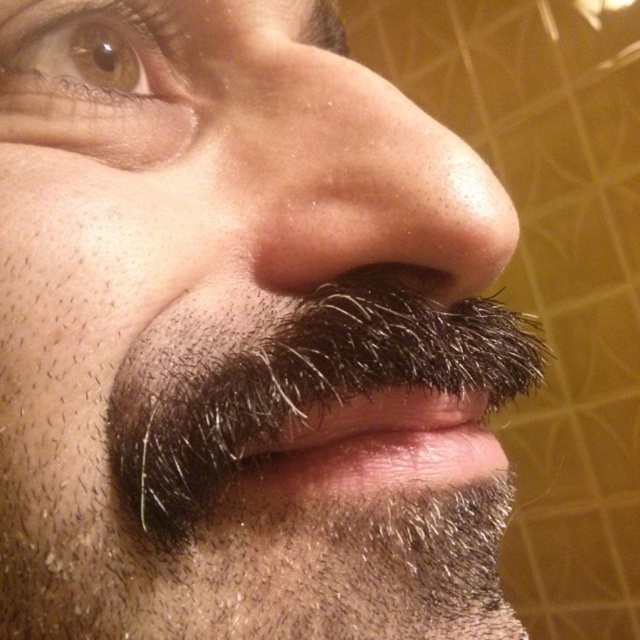
Between smooth skin nose at center and brown matte eye at upper left, which one has more height?

smooth skin nose at center

Is point (417, 173) less distant than point (177, 131)?

Yes, it is.

Is point (376, 244) behind point (150, 86)?

No, (376, 244) is closer to viewer.

You are a GUI agent. You are given a task and a screenshot of the screen. Output one action in this format:
    pyautogui.click(x=<x>, y=<y>)
    Task: Click on the smooth skin nose at center
    
    Given the screenshot: What is the action you would take?
    pyautogui.click(x=371, y=186)

The image size is (640, 640). In order to click on smooth skin nose at center in this screenshot , I will do `click(371, 186)`.

Can you confirm if smooth skin nose at center is positioned to the left of dark brown fur at center?

Yes, smooth skin nose at center is to the left of dark brown fur at center.

Does point (280, 232) come farther from viewer compared to point (458, 397)?

No, it is not.

At what (x,y) coordinates should I click in order to perform the action: click on smooth skin nose at center. Please return your answer as a coordinate pair (x, y). This screenshot has height=640, width=640. Looking at the image, I should click on (371, 186).

Is brown matte eye at upper left smaller than dark brown fur at center?

Correct, brown matte eye at upper left occupies less space than dark brown fur at center.

How far apart are brown matte eye at upper left and dark brown fur at center?

The distance of brown matte eye at upper left from dark brown fur at center is 5.66 inches.

Who is more distant from viewer, (116, 29) or (467, 412)?

Positioned behind is point (467, 412).

The height and width of the screenshot is (640, 640). Identify the location of brown matte eye at upper left. (92, 80).